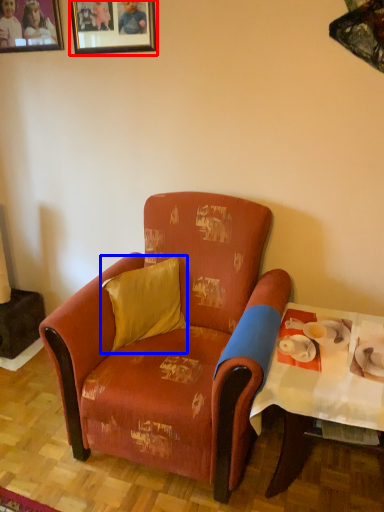
Question: Which of the following is the closest to the observer, picture frame (highlighted by a red box) or pillow (highlighted by a blue box)?

Choices:
 (A) picture frame
 (B) pillow

Answer: (B)